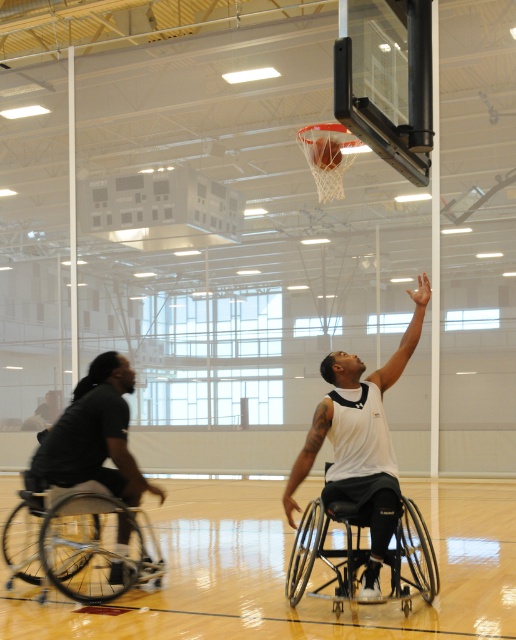
Question: Can you confirm if white matte wheelchair at center is wider than black matte wheelchair at center?

Choices:
 (A) yes
 (B) no

Answer: (B)

Question: Which of the following is the closest to the observer?

Choices:
 (A) wooden floor at center
 (B) silver metallic wheelchair at left
 (C) white jersey at center

Answer: (A)

Question: Which of these objects is positioned farthest from the wooden floor at center?

Choices:
 (A) dark gray fabric wheelchair at left
 (B) silver metallic wheelchair at left
 (C) black matte wheelchair at center
 (D) white jersey at center

Answer: (D)

Question: Is white jersey at center above dark gray fabric wheelchair at left?

Choices:
 (A) no
 (B) yes

Answer: (B)

Question: From the image, what is the correct spatial relationship of white matte wheelchair at center in relation to rubber textured basketball at center?

Choices:
 (A) left
 (B) right

Answer: (B)

Question: Which of the following is the farthest from the observer?

Choices:
 (A) white matte wheelchair at center
 (B) black matte wheelchair at center
 (C) rubber textured basketball at center
 (D) wooden floor at center

Answer: (C)